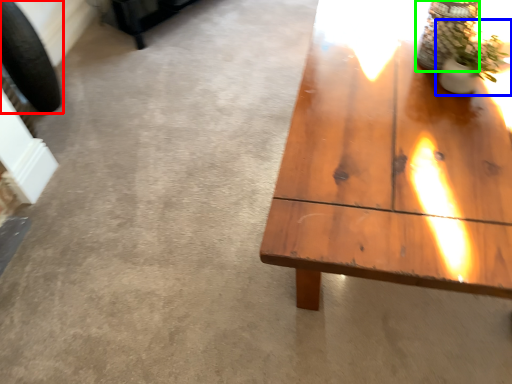
Question: Based on their relative distances, which object is nearer to car tire (highlighted by a red box)? Choose from houseplant (highlighted by a blue box) and glass vase (highlighted by a green box).

Choices:
 (A) houseplant
 (B) glass vase

Answer: (B)